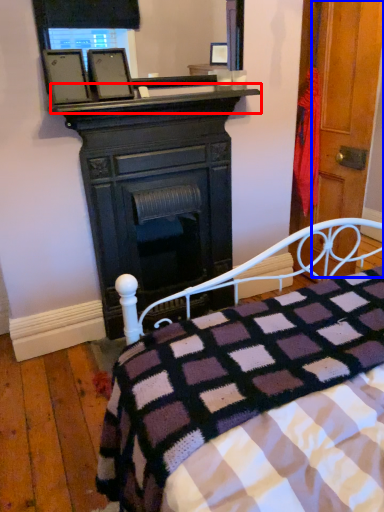
Question: Among these objects, which one is nearest to the camera, mantle (highlighted by a red box) or door (highlighted by a blue box)?

Choices:
 (A) mantle
 (B) door

Answer: (A)